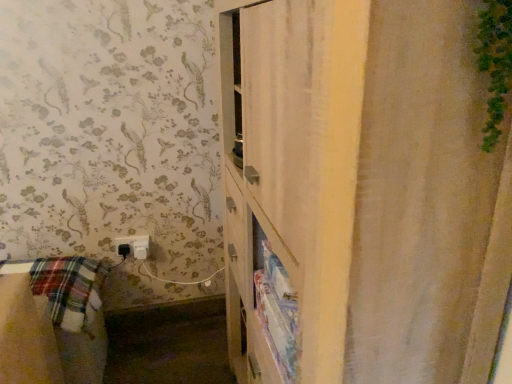
Question: Considering the positions of white plastic electric outlet at lower left and white textured shower curtain at right in the image, is white plastic electric outlet at lower left wider or thinner than white textured shower curtain at right?

Choices:
 (A) wide
 (B) thin

Answer: (B)

Question: Looking at the image, does white plastic electric outlet at lower left seem bigger or smaller compared to white textured shower curtain at right?

Choices:
 (A) small
 (B) big

Answer: (A)

Question: From a real-world perspective, is white plastic electric outlet at lower left above or below white textured shower curtain at right?

Choices:
 (A) below
 (B) above

Answer: (A)

Question: From a real-world perspective, relative to white plastic electric outlet at lower left, is white textured shower curtain at right vertically above or below?

Choices:
 (A) above
 (B) below

Answer: (A)

Question: Looking at the image, does white textured shower curtain at right seem bigger or smaller compared to white plastic electric outlet at lower left?

Choices:
 (A) big
 (B) small

Answer: (A)

Question: Is point (421, 195) closer or farther from the camera than point (133, 238)?

Choices:
 (A) farther
 (B) closer

Answer: (B)

Question: Would you say white textured shower curtain at right is to the left or to the right of white plastic electric outlet at lower left in the picture?

Choices:
 (A) left
 (B) right

Answer: (B)